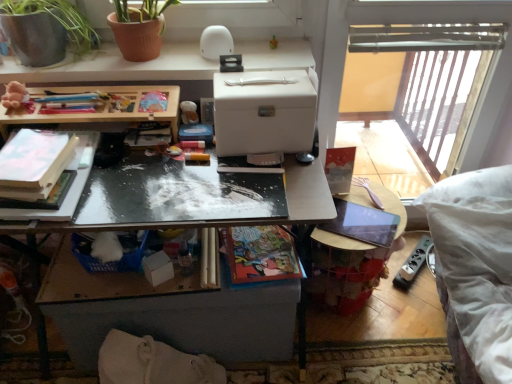
The image size is (512, 384). What do you see at coordinates (189, 112) in the screenshot?
I see `matte plastic cup at center, which appears as the first toy when viewed from the back` at bounding box center [189, 112].

What is the approximate width of wooden at upper left, marked as the second table in a bottom-to-top arrangement?

wooden at upper left, marked as the second table in a bottom-to-top arrangement, is 5.94 inches in width.

What do you see at coordinates (153, 363) in the screenshot? I see `white fabric swivel chair at lower left` at bounding box center [153, 363].

Image resolution: width=512 pixels, height=384 pixels. Describe the element at coordinates (306, 194) in the screenshot. I see `wooden table at center, which ranks as the first table in bottom-to-top order` at that location.

Image resolution: width=512 pixels, height=384 pixels. I want to click on wooden table at center, which ranks as the first table in bottom-to-top order, so click(306, 194).

What do you see at coordinates (35, 158) in the screenshot? I see `matte white book at left, arranged as the first book when viewed from the left` at bounding box center [35, 158].

This screenshot has height=384, width=512. Identify the location of matte white book at left, arranged as the first book when viewed from the left. (35, 158).

You are a GUI agent. You are given a task and a screenshot of the screen. Output one action in this format:
    pyautogui.click(x=<x>, y=<y>)
    Task: Click on the terracotta clay pot at upper left
    The height and width of the screenshot is (384, 512).
    Given the screenshot: What is the action you would take?
    pyautogui.click(x=35, y=38)

Is wooden at upper left, the 1th table from the top, taller or shorter than fluffy beige teddy bear at upper left, the first toy positioned from the front?

wooden at upper left, the 1th table from the top, is taller than fluffy beige teddy bear at upper left, the first toy positioned from the front.

Who is more distant, wooden at upper left, the 1th table from the top, or fluffy beige teddy bear at upper left, marked as the 2th toy in a right-to-left arrangement?

fluffy beige teddy bear at upper left, marked as the 2th toy in a right-to-left arrangement, is behind.

Does wooden at upper left, marked as the second table in a bottom-to-top arrangement, turn towards fluffy beige teddy bear at upper left, which ranks as the second toy in back-to-front order?

No, wooden at upper left, marked as the second table in a bottom-to-top arrangement, is not facing towards fluffy beige teddy bear at upper left, which ranks as the second toy in back-to-front order.

Considering the relative sizes of wooden at upper left, the 1th table from the top, and fluffy beige teddy bear at upper left, the first toy positioned from the front, in the image provided, is wooden at upper left, the 1th table from the top, bigger than fluffy beige teddy bear at upper left, the first toy positioned from the front,?

Yes.

Between matte plastic cup at center, positioned as the 2th toy in left-to-right order, and wooden at upper left, marked as the second table in a bottom-to-top arrangement, which one appears on the right side from the viewer's perspective?

matte plastic cup at center, positioned as the 2th toy in left-to-right order, is more to the right.

In the scene shown: From a real-world perspective, is matte plastic cup at center, the first toy positioned from the right, above or below wooden at upper left, marked as the second table in a bottom-to-top arrangement?

matte plastic cup at center, the first toy positioned from the right, is situated lower than wooden at upper left, marked as the second table in a bottom-to-top arrangement, in the real world.

From the image's perspective, which object appears higher, matte plastic cup at center, the second toy in the front-to-back sequence, or wooden at upper left, marked as the second table in a bottom-to-top arrangement?

From the image's view, matte plastic cup at center, the second toy in the front-to-back sequence, is above.

How distant is white matte desk at upper center from matte paper book at center, which is the 1th book from right to left?

white matte desk at upper center is 56.78 centimeters from matte paper book at center, which is the 1th book from right to left.

Considering the positions of objects white matte desk at upper center and matte paper book at center, which is the third book from left to right, in the image provided, who is more to the left, white matte desk at upper center or matte paper book at center, which is the third book from left to right,?

white matte desk at upper center is more to the left.

Considering the relative positions of white matte desk at upper center and matte paper book at center, which is the third book from left to right, in the image provided, is white matte desk at upper center behind matte paper book at center, which is the third book from left to right,?

Yes, white matte desk at upper center is further from the viewer.

Considering the relative sizes of white matte desk at upper center and matte paper book at center, which is the 1th book from right to left, in the image provided, is white matte desk at upper center smaller than matte paper book at center, which is the 1th book from right to left,?

No, white matte desk at upper center is not smaller than matte paper book at center, which is the 1th book from right to left.

Would you say matte cardboard book at center, marked as the second book in a right-to-left arrangement, is to the left or to the right of white matte desk at upper center in the picture?

Clearly, matte cardboard book at center, marked as the second book in a right-to-left arrangement, is on the right of white matte desk at upper center in the image.

Is point (218, 258) positioned after point (256, 47)?

No, it is in front of (256, 47).

From the image's perspective, between matte cardboard book at center, placed as the second book when sorted from left to right, and white matte desk at upper center, who is located below?

matte cardboard book at center, placed as the second book when sorted from left to right, appears lower in the image.

Looking at this image, is matte cardboard book at center, marked as the second book in a right-to-left arrangement, positioned beyond the bounds of white matte desk at upper center?

matte cardboard book at center, marked as the second book in a right-to-left arrangement, lies outside white matte desk at upper center's area.

Can we say white fabric swivel chair at lower left lies outside wooden table at center, marked as the 2th table in a top-to-bottom arrangement?

Indeed, white fabric swivel chair at lower left is completely outside wooden table at center, marked as the 2th table in a top-to-bottom arrangement.

Find the location of `swivel chair on the left of wooden table at center, marked as the 2th table in a top-to-bottom arrangement`. swivel chair on the left of wooden table at center, marked as the 2th table in a top-to-bottom arrangement is located at coordinates (153, 363).

From a real-world perspective, is white fabric swivel chair at lower left beneath wooden table at center, which ranks as the first table in bottom-to-top order?

Yes, from a real-world perspective, white fabric swivel chair at lower left is beneath wooden table at center, which ranks as the first table in bottom-to-top order.

Is matte plastic cup at center, positioned as the 2th toy in left-to-right order, wider than matte white book at left, the third book positioned from the right?

In fact, matte plastic cup at center, positioned as the 2th toy in left-to-right order, might be narrower than matte white book at left, the third book positioned from the right.

From the image's perspective, is matte plastic cup at center, the first toy positioned from the right, beneath matte white book at left, the third book positioned from the right?

Actually, matte plastic cup at center, the first toy positioned from the right, appears above matte white book at left, the third book positioned from the right, in the image.

From a real-world perspective, who is located lower, matte plastic cup at center, positioned as the 2th toy in left-to-right order, or matte white book at left, arranged as the first book when viewed from the left?

matte plastic cup at center, positioned as the 2th toy in left-to-right order, from a real-world perspective.

At what (x,y) coordinates should I click in order to perform the action: click on swivel chair in front of the matte cardboard book at center, placed as the second book when sorted from left to right. Please return your answer as a coordinate pair (x, y). The height and width of the screenshot is (384, 512). Looking at the image, I should click on (153, 363).

Between point (201, 277) and point (148, 368), which one is positioned in front?

Point (148, 368)

Is matte cardboard book at center, placed as the second book when sorted from left to right, facing away from white fabric swivel chair at lower left?

matte cardboard book at center, placed as the second book when sorted from left to right, does not have its back to white fabric swivel chair at lower left.

How far apart are matte cardboard book at center, placed as the second book when sorted from left to right, and white fabric swivel chair at lower left?

matte cardboard book at center, placed as the second book when sorted from left to right, and white fabric swivel chair at lower left are 12.16 inches apart.

Identify the location of table lying in front of the fluffy beige teddy bear at upper left, the first toy positioned from the front. The height and width of the screenshot is (384, 512). (100, 107).

You are a GUI agent. You are given a task and a screenshot of the screen. Output one action in this format:
    pyautogui.click(x=<x>, y=<y>)
    Task: Click on the table above the matte plastic cup at center, the first toy positioned from the right (from a real-world perspective)
    This screenshot has width=512, height=384.
    Given the screenshot: What is the action you would take?
    pyautogui.click(x=100, y=107)

When comparing their distances from matte plastic cup at center, positioned as the 2th toy in left-to-right order, does wooden table at center, marked as the 2th table in a top-to-bottom arrangement, or matte paper book at center, which is the third book from left to right, seem closer?

Among the two, matte paper book at center, which is the third book from left to right, is located nearer to matte plastic cup at center, positioned as the 2th toy in left-to-right order.

Looking at the image, which one is located closer to wooden at upper left, the 1th table from the top, matte paper book at center, which is the 1th book from right to left, or wooden table at center, which ranks as the first table in bottom-to-top order?

The object closer to wooden at upper left, the 1th table from the top, is wooden table at center, which ranks as the first table in bottom-to-top order.

Considering their positions, is white fabric swivel chair at lower left positioned further to matte paper book at center, which is the 1th book from right to left, than fluffy beige teddy bear at upper left, which ranks as the second toy in back-to-front order?

fluffy beige teddy bear at upper left, which ranks as the second toy in back-to-front order, lies further to matte paper book at center, which is the 1th book from right to left, than the other object.

From the image, which object appears to be nearer to wooden table at center, marked as the 2th table in a top-to-bottom arrangement, terracotta clay pot at upper left or matte white book at left, arranged as the first book when viewed from the left?

matte white book at left, arranged as the first book when viewed from the left.

Considering their positions, is wooden at upper left, marked as the second table in a bottom-to-top arrangement, positioned closer to fluffy beige teddy bear at upper left, marked as the 2th toy in a right-to-left arrangement, than white fabric swivel chair at lower left?

wooden at upper left, marked as the second table in a bottom-to-top arrangement, is closer to fluffy beige teddy bear at upper left, marked as the 2th toy in a right-to-left arrangement.

Considering their positions, is wooden table at center, which ranks as the first table in bottom-to-top order, positioned further to wooden at upper left, the 1th table from the top, than matte plastic cup at center, which appears as the first toy when viewed from the back?

wooden table at center, which ranks as the first table in bottom-to-top order.

From the picture: When comparing their distances from matte white book at left, arranged as the first book when viewed from the left, does matte paper book at center, which is the third book from left to right, or fluffy beige teddy bear at upper left, the first toy from the left, seem closer?

Based on the image, fluffy beige teddy bear at upper left, the first toy from the left, appears to be nearer to matte white book at left, arranged as the first book when viewed from the left.

Based on the photo, when comparing their distances from matte white book at left, arranged as the first book when viewed from the left, does wooden at upper left, the 1th table from the top, or white matte desk at upper center seem closer?

wooden at upper left, the 1th table from the top.

Locate an element on the screen. toy situated between matte white book at left, the third book positioned from the right, and matte cardboard book at center, marked as the second book in a right-to-left arrangement, from left to right is located at coordinates (189, 112).

Identify the location of book between matte cardboard book at center, marked as the second book in a right-to-left arrangement, and white fabric swivel chair at lower left in the up-down direction. Image resolution: width=512 pixels, height=384 pixels. (261, 254).

At what (x,y) coordinates should I click in order to perform the action: click on toy between fluffy beige teddy bear at upper left, marked as the 2th toy in a right-to-left arrangement, and white fabric swivel chair at lower left from top to bottom. Please return your answer as a coordinate pair (x, y). Looking at the image, I should click on (189, 112).

Locate an element on the screen. This screenshot has width=512, height=384. table between terracotta clay pot at upper left and wooden table at center, which ranks as the first table in bottom-to-top order, from top to bottom is located at coordinates (100, 107).